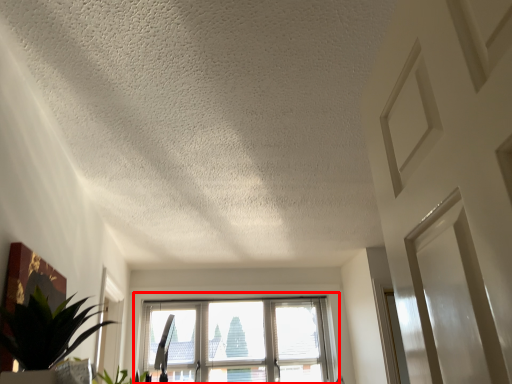
Question: From the image, what is the correct spatial relationship of window (annotated by the red box) in relation to houseplant?

Choices:
 (A) left
 (B) right

Answer: (B)